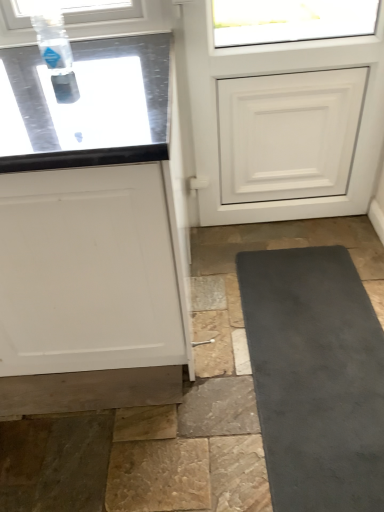
Question: Is point (82, 212) closer or farther from the camera than point (357, 84)?

Choices:
 (A) closer
 (B) farther

Answer: (A)

Question: In terms of size, does white matte cabinet at left appear bigger or smaller than white matte door at upper center?

Choices:
 (A) big
 (B) small

Answer: (A)

Question: Which object is positioned farthest from the white matte door at upper center?

Choices:
 (A) transparent plastic bottle at upper left
 (B) white matte cabinet at left

Answer: (A)

Question: Which is nearer to the white matte cabinet at left?

Choices:
 (A) transparent plastic bottle at upper left
 (B) white matte door at upper center

Answer: (A)